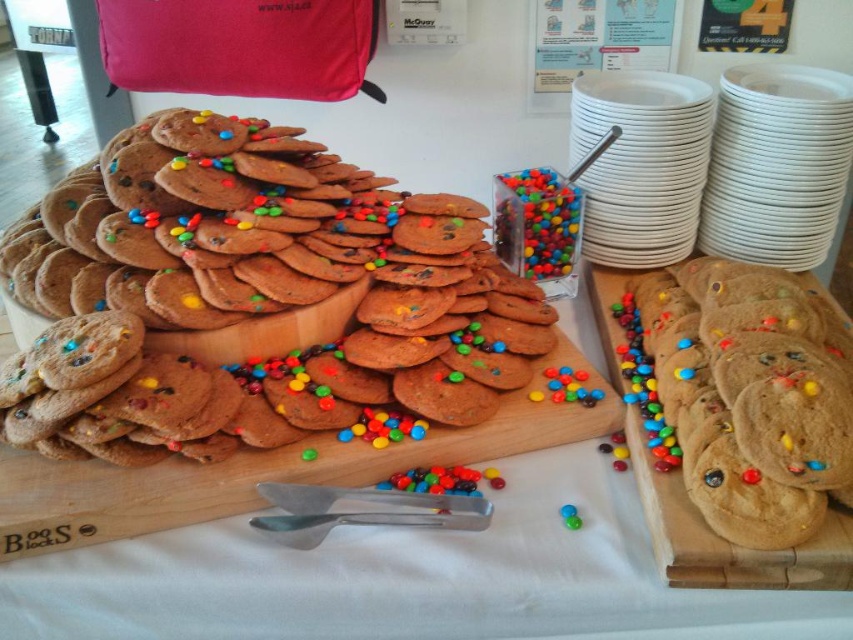
You are at a dessert buffet and want to grab a cookie. You see the brown matte cookie at center and the brown wooden board at center. Which one takes up more space on the table?

The brown wooden board at center takes up more space because the brown matte cookie at center occupies less space than it.

You are at a buffet and want to grab a cookie from the chocolate chip cookies at center and the brown matte cookie at center. Which platter is located to the left side of the other?

The chocolate chip cookies at center is to the left of brown matte cookie at center, so the chocolate chip cookies at center platter is located to the left side of the brown matte cookie at center platter.

You are at a party and want to grab a cookie from the platter. The chocolate chip cookies at center are your favorite, but you notice the brown matte cookie at center is also present. Which cookie should you reach for first if you want to grab the one that is closer to you?

You should reach for the chocolate chip cookies at center first because the brown matte cookie at center is behind them, making the chocolate chip cookies closer to you.